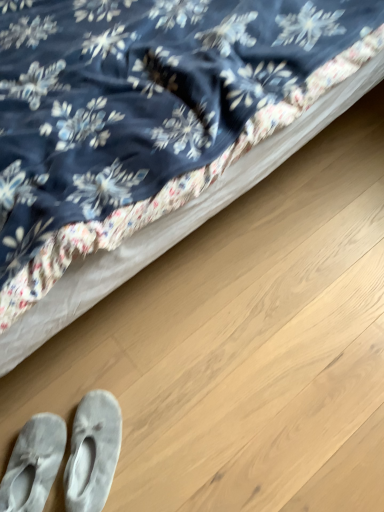
I want to click on unoccupied region to the right of light gray suede slippers at lower left, arranged as the second footwear when viewed from the left, so click(165, 442).